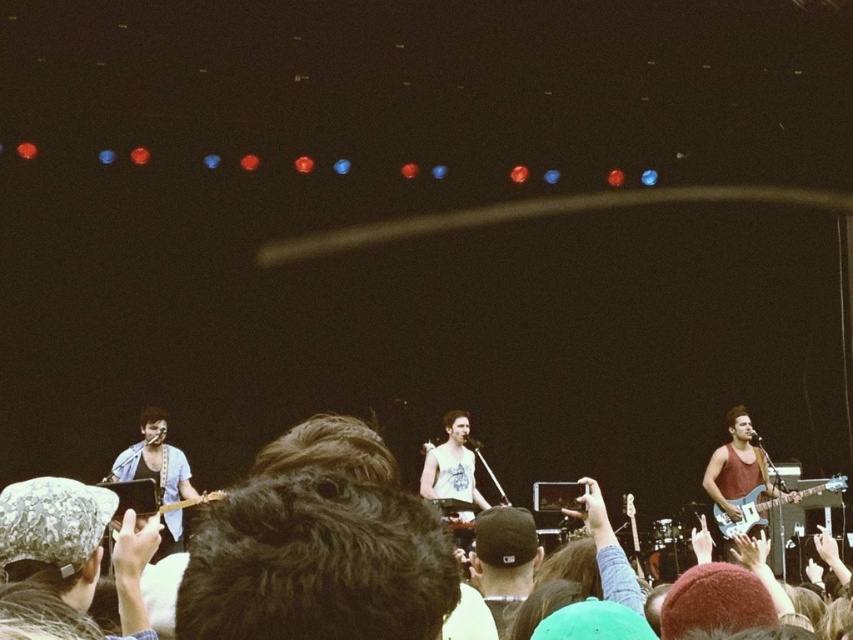
Question: Is black fabric cap at center bigger than wooden acoustic guitar at lower left?

Choices:
 (A) yes
 (B) no

Answer: (B)

Question: Where is black fabric cap at center located in relation to matte electric guitar at right in the image?

Choices:
 (A) below
 (B) above

Answer: (B)

Question: Is matte electric guitar at right to the left of wooden acoustic guitar at lower left from the viewer's perspective?

Choices:
 (A) yes
 (B) no

Answer: (B)

Question: Which point is closer to the camera?

Choices:
 (A) wooden acoustic guitar at lower left
 (B) matte electric guitar at right

Answer: (A)

Question: Which of these objects is positioned closest to the matte electric guitar at right?

Choices:
 (A) wooden acoustic guitar at lower left
 (B) black fabric cap at center

Answer: (B)

Question: Which of the following is the closest to the observer?

Choices:
 (A) wooden acoustic guitar at lower left
 (B) black fabric cap at center

Answer: (B)